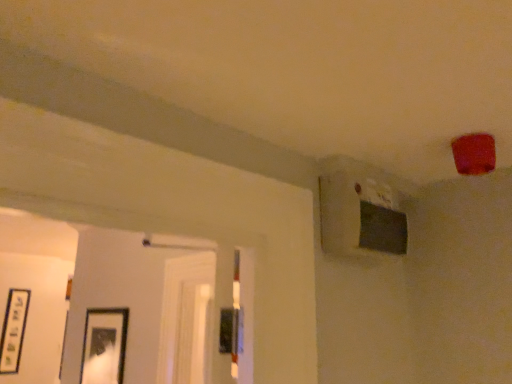
You are a GUI agent. You are given a task and a screenshot of the screen. Output one action in this format:
    pyautogui.click(x=<x>, y=<y>)
    Task: Click on the matte black picture frame at lower left, the 1th picture frame when ordered from right to left
    The height and width of the screenshot is (384, 512).
    Given the screenshot: What is the action you would take?
    pyautogui.click(x=104, y=346)

This screenshot has height=384, width=512. What do you see at coordinates (104, 346) in the screenshot?
I see `matte black picture frame at lower left, which is counted as the 1th picture frame, starting from the front` at bounding box center [104, 346].

This screenshot has height=384, width=512. What do you see at coordinates (13, 330) in the screenshot?
I see `black matte picture frame at lower left, placed as the second picture frame when sorted from right to left` at bounding box center [13, 330].

Identify the location of black matte picture frame at lower left, placed as the second picture frame when sorted from right to left. (13, 330).

Locate an element on the screen. The width and height of the screenshot is (512, 384). matte black picture frame at lower left, the 2th picture frame when ordered from left to right is located at coordinates (104, 346).

Considering the positions of objects matte black picture frame at lower left, the 1th picture frame when ordered from right to left, and black matte picture frame at lower left, which appears as the 2th picture frame when viewed from the front, in the image provided, who is more to the right, matte black picture frame at lower left, the 1th picture frame when ordered from right to left, or black matte picture frame at lower left, which appears as the 2th picture frame when viewed from the front,?

matte black picture frame at lower left, the 1th picture frame when ordered from right to left.

Is the position of matte black picture frame at lower left, which is counted as the 1th picture frame, starting from the front, less distant than that of black matte picture frame at lower left, the first picture frame from the bottom?

Yes, it is in front of black matte picture frame at lower left, the first picture frame from the bottom.

Which is behind, point (98, 365) or point (18, 298)?

Positioned behind is point (18, 298).

From the image's perspective, is matte black picture frame at lower left, the 1th picture frame when ordered from right to left, on top of black matte picture frame at lower left, marked as the 2th picture frame in a top-to-bottom arrangement?

Yes, from the image's perspective, matte black picture frame at lower left, the 1th picture frame when ordered from right to left, is on top of black matte picture frame at lower left, marked as the 2th picture frame in a top-to-bottom arrangement.

From a real-world perspective, is matte black picture frame at lower left, which is counted as the 2th picture frame, starting from the back, physically located above or below black matte picture frame at lower left, arranged as the first picture frame when viewed from the left?

In terms of real-world spatial position, matte black picture frame at lower left, which is counted as the 2th picture frame, starting from the back, is below black matte picture frame at lower left, arranged as the first picture frame when viewed from the left.

Is matte black picture frame at lower left, the 1th picture frame when ordered from right to left, thinner than black matte picture frame at lower left, placed as the second picture frame when sorted from right to left?

No, matte black picture frame at lower left, the 1th picture frame when ordered from right to left, is not thinner than black matte picture frame at lower left, placed as the second picture frame when sorted from right to left.

Does matte black picture frame at lower left, positioned as the 1th picture frame in top-to-bottom order, have a lesser height compared to black matte picture frame at lower left, placed as the second picture frame when sorted from right to left?

Yes, matte black picture frame at lower left, positioned as the 1th picture frame in top-to-bottom order, is shorter than black matte picture frame at lower left, placed as the second picture frame when sorted from right to left.

Is matte black picture frame at lower left, the 1th picture frame when ordered from right to left, bigger or smaller than black matte picture frame at lower left, arranged as the first picture frame when viewed from the left?

Clearly, matte black picture frame at lower left, the 1th picture frame when ordered from right to left, is larger in size than black matte picture frame at lower left, arranged as the first picture frame when viewed from the left.

Can black matte picture frame at lower left, the first picture frame from the bottom, be found inside matte black picture frame at lower left, the 1th picture frame when ordered from right to left?

No.

Are matte black picture frame at lower left, which is counted as the 2th picture frame, starting from the back, and black matte picture frame at lower left, which appears as the 2th picture frame when viewed from the front, making contact?

They are not placed beside each other.

Could you tell me if matte black picture frame at lower left, the 1th picture frame when ordered from right to left, is facing black matte picture frame at lower left, marked as the 2th picture frame in a top-to-bottom arrangement?

No, matte black picture frame at lower left, the 1th picture frame when ordered from right to left, does not turn towards black matte picture frame at lower left, marked as the 2th picture frame in a top-to-bottom arrangement.

How far apart are matte black picture frame at lower left, which is counted as the 2th picture frame, starting from the back, and black matte picture frame at lower left, which appears as the 2th picture frame when viewed from the front?

14.11 feet.

The height and width of the screenshot is (384, 512). Identify the location of picture frame on the left of matte black picture frame at lower left, positioned as the 1th picture frame in top-to-bottom order. (13, 330).

Would you say black matte picture frame at lower left, the first picture frame from the bottom, is to the left or to the right of matte black picture frame at lower left, placed as the 2th picture frame when sorted from bottom to top, in the picture?

From the image, it's evident that black matte picture frame at lower left, the first picture frame from the bottom, is to the left of matte black picture frame at lower left, placed as the 2th picture frame when sorted from bottom to top.

Which object is closer to the camera, black matte picture frame at lower left, arranged as the first picture frame when viewed from the left, or matte black picture frame at lower left, placed as the 2th picture frame when sorted from bottom to top?

matte black picture frame at lower left, placed as the 2th picture frame when sorted from bottom to top.

Considering the positions of points (9, 339) and (109, 344), is point (9, 339) farther from camera compared to point (109, 344)?

That is True.

From the image's perspective, which one is positioned lower, black matte picture frame at lower left, marked as the 2th picture frame in a top-to-bottom arrangement, or matte black picture frame at lower left, the 1th picture frame when ordered from right to left?

black matte picture frame at lower left, marked as the 2th picture frame in a top-to-bottom arrangement, from the image's perspective.

From a real-world perspective, is black matte picture frame at lower left, which appears as the 2th picture frame when viewed from the front, positioned under matte black picture frame at lower left, placed as the 2th picture frame when sorted from bottom to top, based on gravity?

No, from a real-world perspective, black matte picture frame at lower left, which appears as the 2th picture frame when viewed from the front, is not under matte black picture frame at lower left, placed as the 2th picture frame when sorted from bottom to top.

Considering the sizes of objects black matte picture frame at lower left, arranged as the first picture frame when viewed from the left, and matte black picture frame at lower left, the 2th picture frame when ordered from left to right, in the image provided, who is wider, black matte picture frame at lower left, arranged as the first picture frame when viewed from the left, or matte black picture frame at lower left, the 2th picture frame when ordered from left to right,?

matte black picture frame at lower left, the 2th picture frame when ordered from left to right.

In terms of height, does black matte picture frame at lower left, marked as the 2th picture frame in a top-to-bottom arrangement, look taller or shorter compared to matte black picture frame at lower left, which is counted as the 1th picture frame, starting from the front?

In the image, black matte picture frame at lower left, marked as the 2th picture frame in a top-to-bottom arrangement, appears to be taller than matte black picture frame at lower left, which is counted as the 1th picture frame, starting from the front.

In terms of size, does black matte picture frame at lower left, the first picture frame from the bottom, appear bigger or smaller than matte black picture frame at lower left, placed as the 2th picture frame when sorted from bottom to top?

Considering their sizes, black matte picture frame at lower left, the first picture frame from the bottom, takes up less space than matte black picture frame at lower left, placed as the 2th picture frame when sorted from bottom to top.

Can we say black matte picture frame at lower left, marked as the 2th picture frame in a top-to-bottom arrangement, lies outside matte black picture frame at lower left, placed as the 2th picture frame when sorted from bottom to top?

Indeed, black matte picture frame at lower left, marked as the 2th picture frame in a top-to-bottom arrangement, is completely outside matte black picture frame at lower left, placed as the 2th picture frame when sorted from bottom to top.

Are black matte picture frame at lower left, arranged as the first picture frame when viewed from the left, and matte black picture frame at lower left, placed as the 2th picture frame when sorted from bottom to top, making contact?

No, black matte picture frame at lower left, arranged as the first picture frame when viewed from the left, is not touching matte black picture frame at lower left, placed as the 2th picture frame when sorted from bottom to top.

Is black matte picture frame at lower left, the first picture frame in the back-to-front sequence, oriented away from matte black picture frame at lower left, positioned as the 1th picture frame in top-to-bottom order?

That's not correct — black matte picture frame at lower left, the first picture frame in the back-to-front sequence, is not looking away from matte black picture frame at lower left, positioned as the 1th picture frame in top-to-bottom order.

The height and width of the screenshot is (384, 512). Find the location of `picture frame lying below the matte black picture frame at lower left, which is counted as the 1th picture frame, starting from the front (from the image's perspective)`. picture frame lying below the matte black picture frame at lower left, which is counted as the 1th picture frame, starting from the front (from the image's perspective) is located at coordinates (13, 330).

This screenshot has width=512, height=384. I want to click on picture frame lying behind the matte black picture frame at lower left, which is counted as the 2th picture frame, starting from the back, so click(13, 330).

Image resolution: width=512 pixels, height=384 pixels. I want to click on picture frame in front of the black matte picture frame at lower left, the first picture frame in the back-to-front sequence, so click(104, 346).